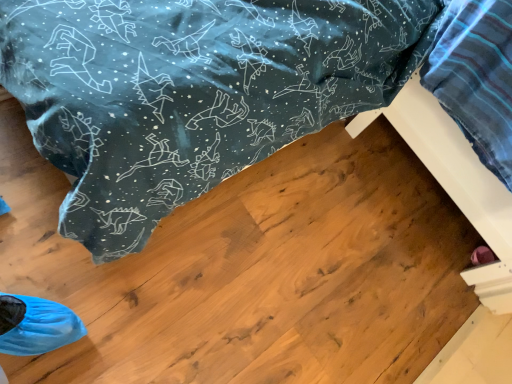
Locate an element on the screen. Image resolution: width=512 pixels, height=384 pixels. free space above wooden bed frame at lower right, which is the second furniture from right to left (from a real-world perspective) is located at coordinates (306, 259).